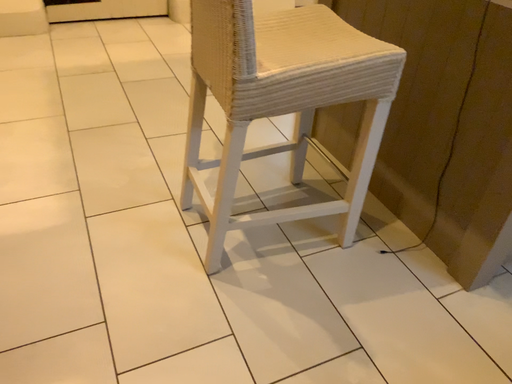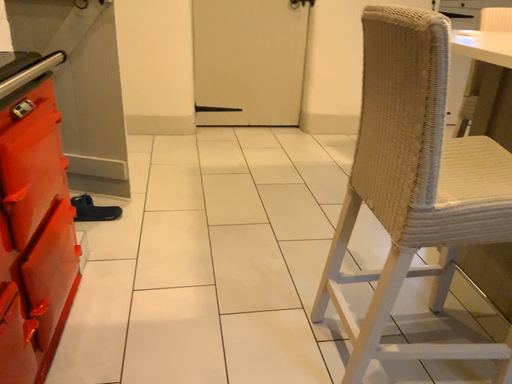
Question: Which way did the camera rotate in the video?

Choices:
 (A) rotated left
 (B) rotated right

Answer: (A)